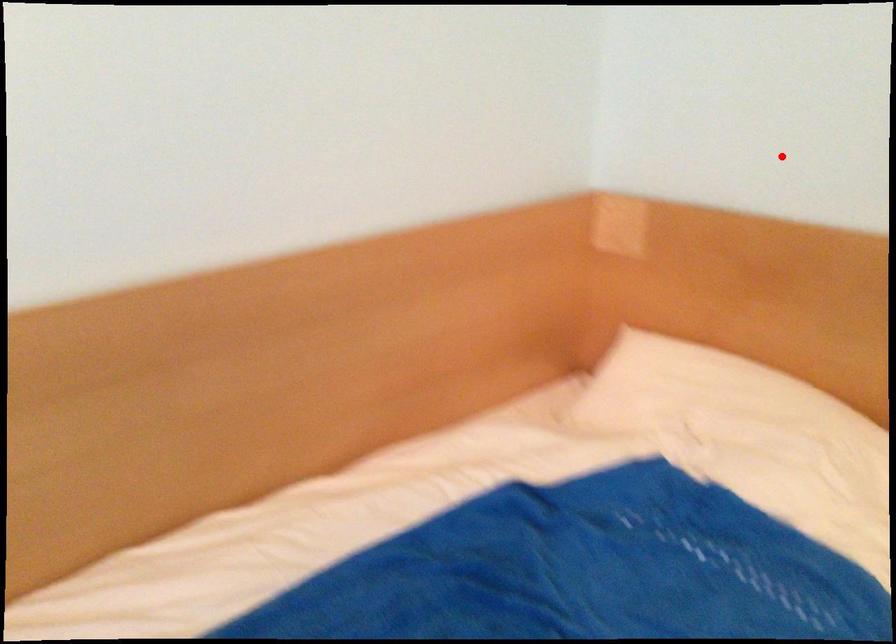
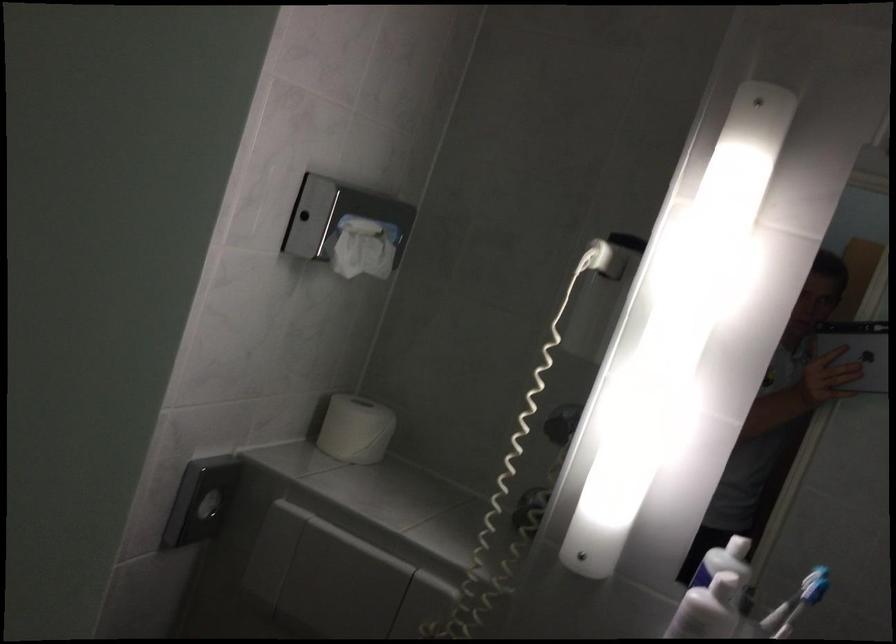
The point at the highlighted location is marked in the first image. Where is the corresponding point in the second image?

(208, 506)